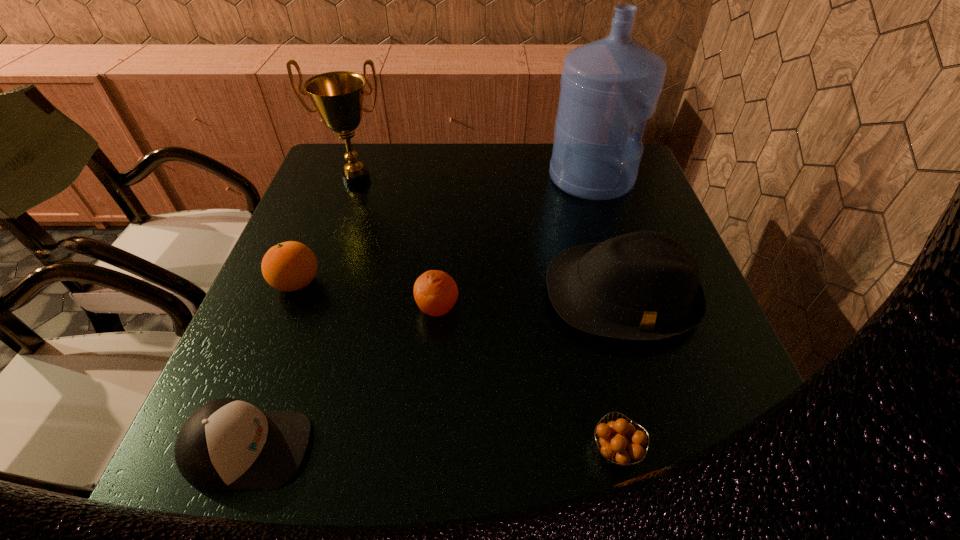
This screenshot has width=960, height=540. I want to click on free spot between the cap and the shortest object, so click(432, 449).

Locate an element on the screen. The image size is (960, 540). free spot between the fedora and the second tallest object is located at coordinates (489, 237).

Find the location of a particular element. vacant area between the cap and the fifth shortest object is located at coordinates (435, 372).

Find the location of a particular element. The width and height of the screenshot is (960, 540). empty location between the second orange fruit from right to left and the shortest object is located at coordinates (526, 380).

What are the coordinates of `vacant space in between the cap and the nearest orange fruit` in the screenshot? It's located at (432, 449).

Where is `free point between the cap and the leftmost orange fruit`? The image size is (960, 540). free point between the cap and the leftmost orange fruit is located at coordinates (273, 366).

The image size is (960, 540). Find the location of `free space between the second tallest object and the second orange fruit from right to left`. free space between the second tallest object and the second orange fruit from right to left is located at coordinates (397, 244).

This screenshot has height=540, width=960. In order to click on free space between the fourth object from left to right and the fifth shortest object in this screenshot , I will do `click(529, 302)`.

In order to click on free spot between the rightmost orange fruit and the fourth object from left to right in this screenshot , I will do `click(526, 380)`.

Where is `object that stands as the third closest to the water jug`? Image resolution: width=960 pixels, height=540 pixels. object that stands as the third closest to the water jug is located at coordinates [338, 96].